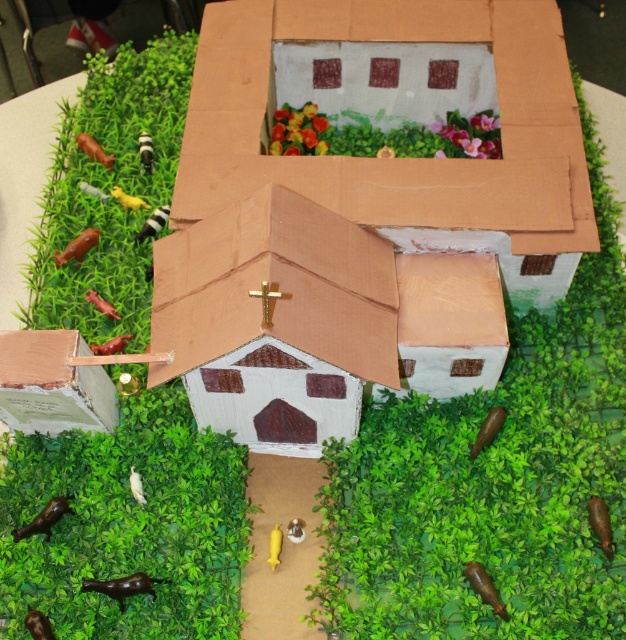
You are a toy farmer trying to place a brown matte cow at lower left in your miniature diorama. The matte cardboard church at center is already there. Can the cow fit next to the church without overlapping?

The matte cardboard church at center is larger in size than brown matte cow at lower left. Since the cow is smaller, it can fit next to the church without overlapping.

You are designing a virtual tour of the miniature diorama and need to place a virtual camera. The camera must be positioned to the north of the matte cardboard church at center. What coordinate should the camera be placed at to ensure it is directly north?

The matte cardboard church at center is located at point (x=387, y=157). To place the camera directly north, it should be positioned at a coordinate with the same x value but a higher y value. For example, moving north would increase the y coordinate. A suitable coordinate could be (x=449, y=157), ensuring it is directly north of the church.